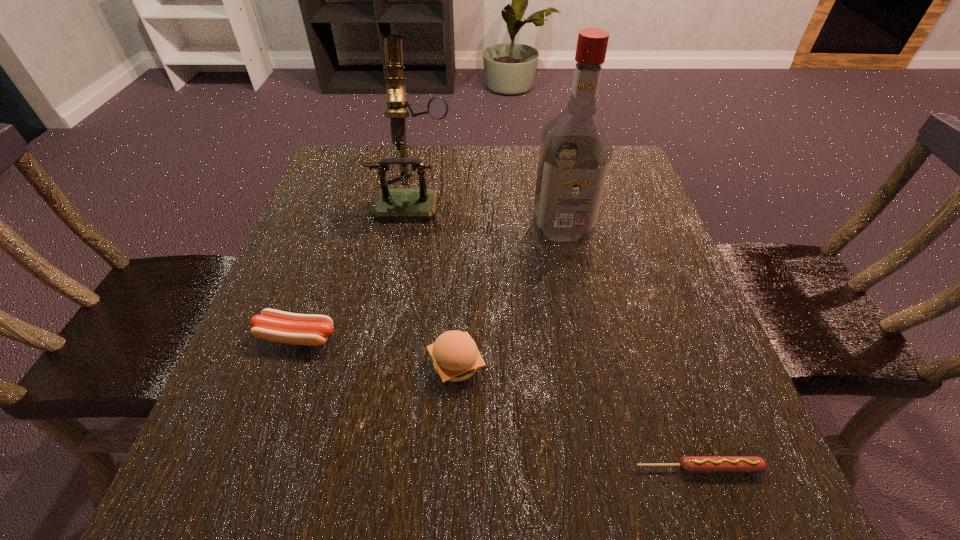
Identify the location of vacant position in the image that satisfies the following two spatial constraints: 1. at the eyepiece of the third shortest object; 2. on the left side of the second tallest object. (386, 364).

This screenshot has width=960, height=540. Find the location of `vacant area in the image that satisfies the following two spatial constraints: 1. on the front side of the third shortest object; 2. on the left side of the left sausage`. vacant area in the image that satisfies the following two spatial constraints: 1. on the front side of the third shortest object; 2. on the left side of the left sausage is located at coordinates (x=287, y=364).

Identify the location of free spot that satisfies the following two spatial constraints: 1. at the eyepiece of the right sausage; 2. on the left side of the microscope. This screenshot has width=960, height=540. (368, 468).

This screenshot has width=960, height=540. Identify the location of free space that satisfies the following two spatial constraints: 1. on the front side of the nearer sausage; 2. on the right side of the third tallest object. (451, 468).

At what (x,y) coordinates should I click in order to perform the action: click on free space that satisfies the following two spatial constraints: 1. at the eyepiece of the right sausage; 2. on the left side of the microscope. Please return your answer as a coordinate pair (x, y). The image size is (960, 540). Looking at the image, I should click on (368, 468).

I want to click on vacant area in the image that satisfies the following two spatial constraints: 1. on the front-facing side of the shortest object; 2. on the left side of the liquor, so click(x=610, y=468).